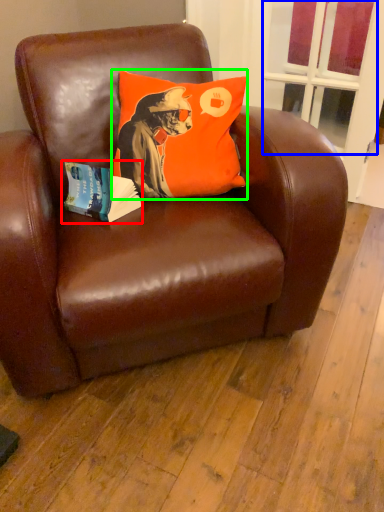
Question: Which is farther away from paperback book (highlighted by a red box)? window screen (highlighted by a blue box) or pillow (highlighted by a green box)?

Choices:
 (A) window screen
 (B) pillow

Answer: (A)